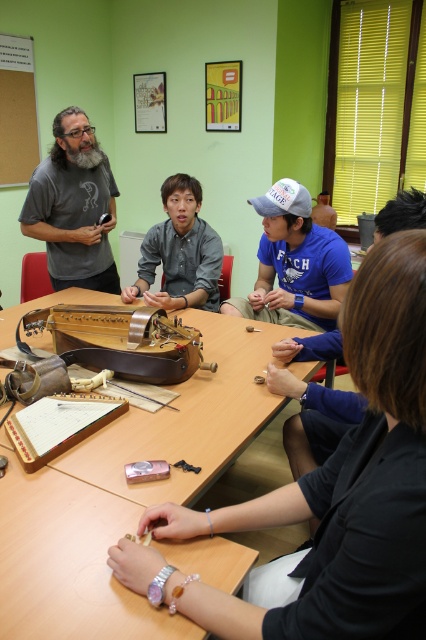
Does gray matte t-shirt at left appear on the left side of gray shirt at center?

Indeed, gray matte t-shirt at left is positioned on the left side of gray shirt at center.

Is point (83, 156) positioned after point (178, 204)?

Yes, it is.

Image resolution: width=426 pixels, height=640 pixels. Describe the element at coordinates (74, 205) in the screenshot. I see `gray matte t-shirt at left` at that location.

Locate an element on the screen. gray matte t-shirt at left is located at coordinates (74, 205).

Who is lower down, matte brown wooden instrument at center or gray shirt at center?

matte brown wooden instrument at center is lower down.

Does point (403, 355) lie in front of point (215, 308)?

Yes.

Does point (328, 531) come in front of point (195, 248)?

Yes, it is in front of point (195, 248).

At what (x,y) coordinates should I click in order to perform the action: click on matte brown wooden instrument at center. Please return your answer as a coordinate pair (x, y). This screenshot has height=640, width=426. Looking at the image, I should click on (334, 488).

Between point (123, 369) and point (184, 260), which one is positioned in front?

Point (123, 369) is in front.

Find the location of a particular element. Image resolution: width=426 pixels, height=640 pixels. brown leather instrument at center is located at coordinates (121, 340).

Identify the location of brown leather instrument at center. (121, 340).